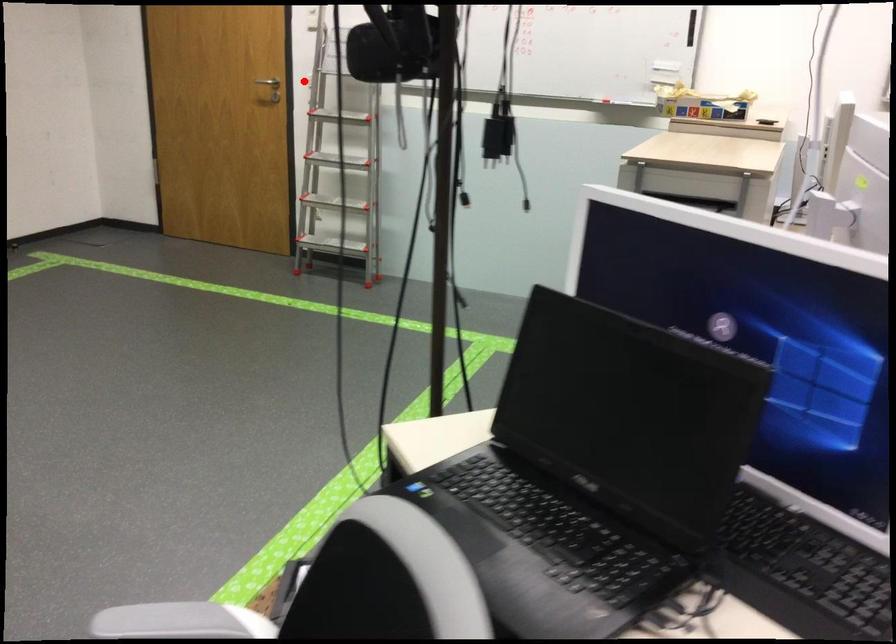
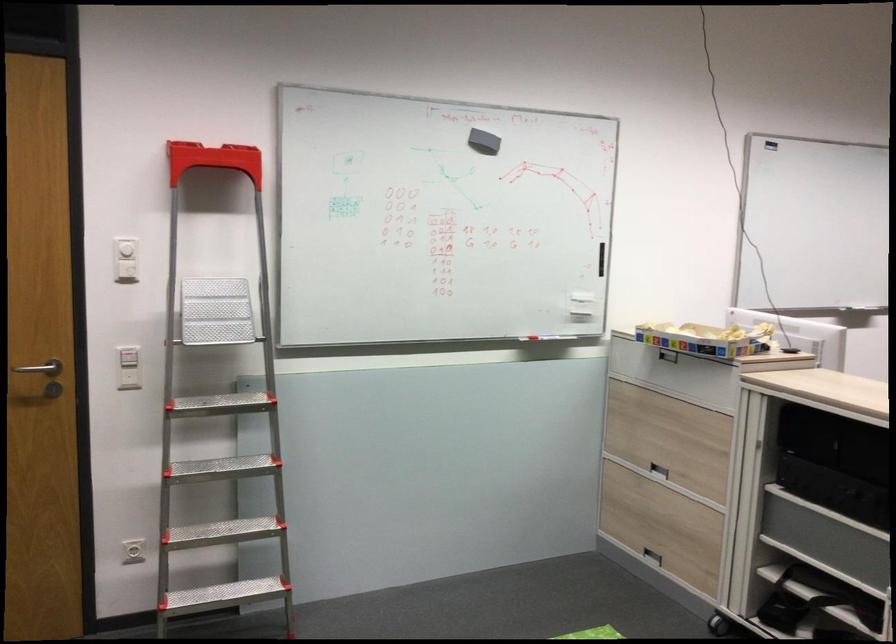
Question: I am providing you with two images of the same scene from different viewpoints. Image1 has a red point marked. In image2, the corresponding 3D location appears at what relative position? Reply with the corresponding letter.

Choices:
 (A) Closer
 (B) Farther

Answer: (A)